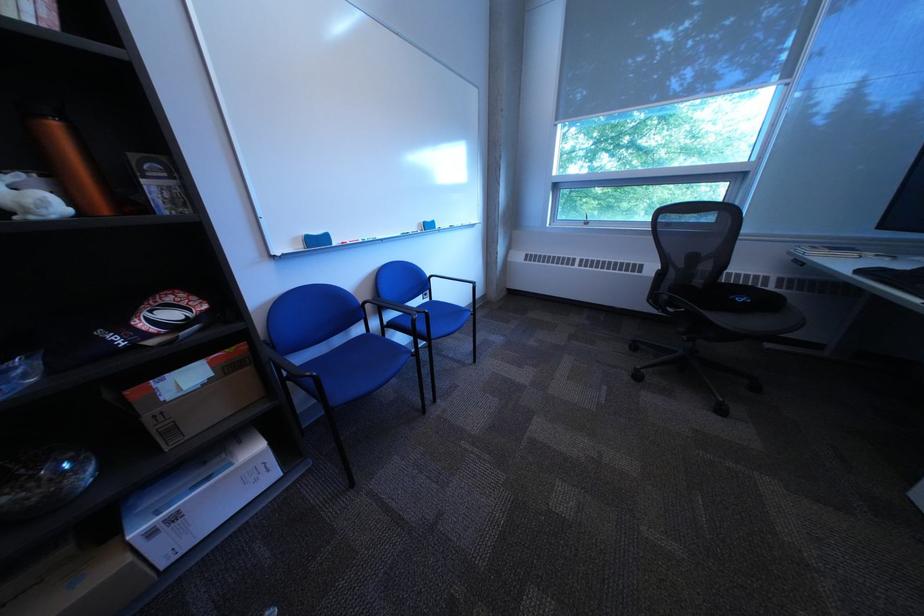
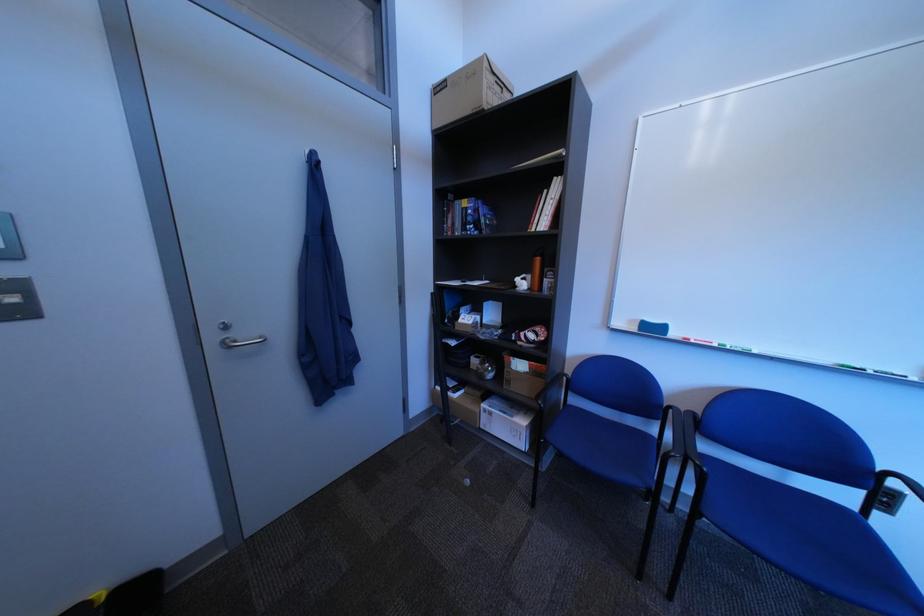
The point at (190, 430) is marked in the first image. Where is the corresponding point in the second image?

(525, 383)